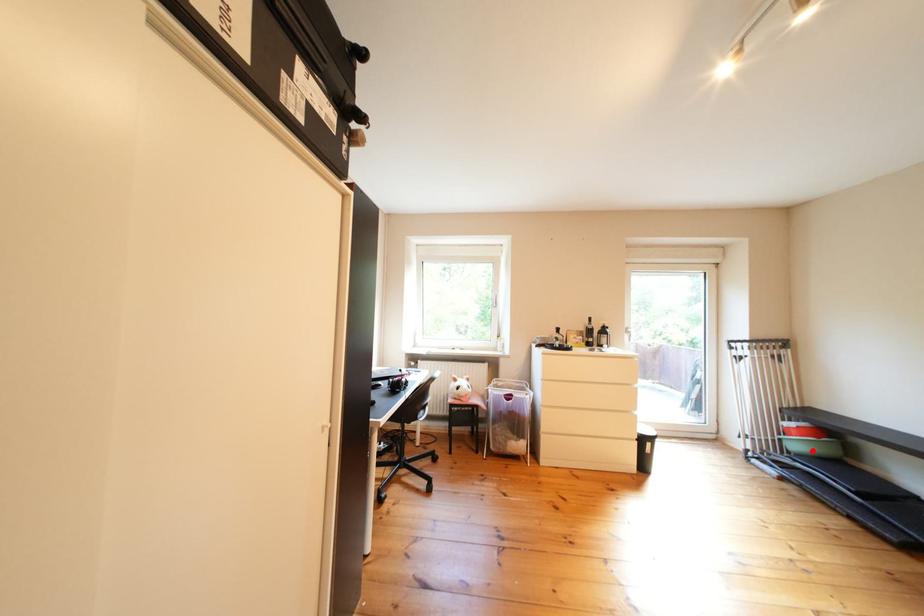
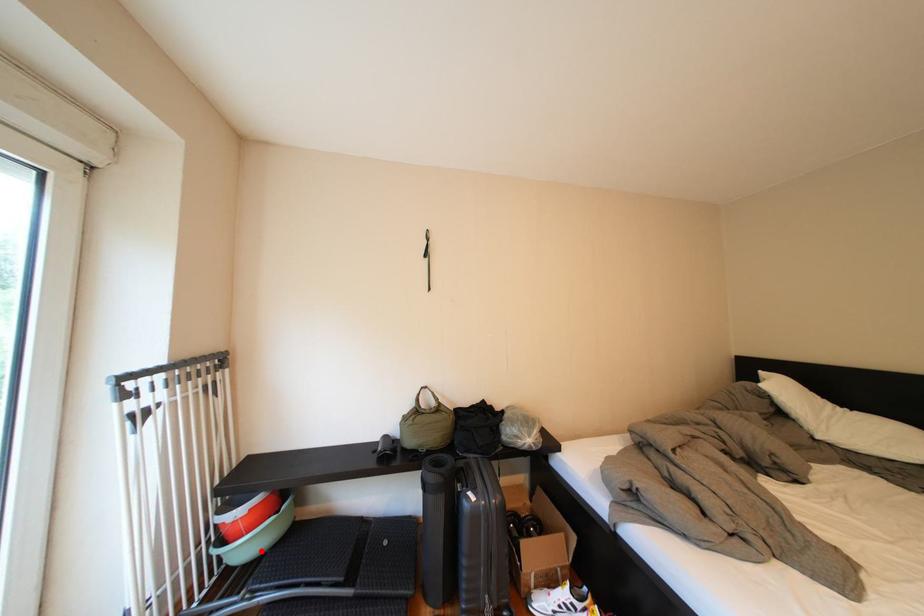
I am providing you with two images of the same scene from different viewpoints. A red point is marked on the first image and another point is marked on the second image. Is the red point in image1 aligned with the point shown in image2?

Yes